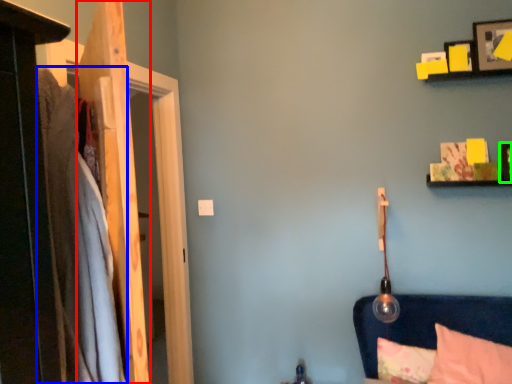
Question: Considering the real-world distances, which object is farthest from door (highlighted by a red box)? blanket (highlighted by a blue box) or picture frame (highlighted by a green box)?

Choices:
 (A) blanket
 (B) picture frame

Answer: (B)